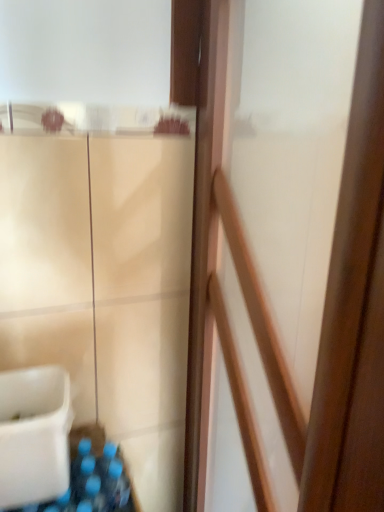
What do you see at coordinates (34, 435) in the screenshot? I see `white plastic sink at lower left` at bounding box center [34, 435].

This screenshot has height=512, width=384. Identify the location of white plastic sink at lower left. (34, 435).

What is the approximate width of wooden screen door at center?

wooden screen door at center is 7.12 inches in width.

In order to face wooden screen door at center, should I rotate leftwards or rightwards?

To face it directly, rotate right by 9.603 degrees.

Describe the element at coordinates (324, 303) in the screenshot. I see `wooden screen door at center` at that location.

This screenshot has height=512, width=384. I want to click on wooden screen door at center, so click(x=324, y=303).

Measure the distance between point (310, 462) and camera.

17.20 inches.

I want to click on white plastic sink at lower left, so click(34, 435).

Can you confirm if wooden screen door at center is positioned to the left of white plastic sink at lower left?

No.

Which object is more forward, wooden screen door at center or white plastic sink at lower left?

wooden screen door at center is more forward.

From the picture: Which is further, (282, 429) or (19, 464)?

The point (19, 464) is farther.

From the image's perspective, is wooden screen door at center located beneath white plastic sink at lower left?

Actually, wooden screen door at center appears above white plastic sink at lower left in the image.

From a real-world perspective, is wooden screen door at center positioned above or below white plastic sink at lower left?

From a real-world perspective, wooden screen door at center is physically above white plastic sink at lower left.

Considering the sizes of objects wooden screen door at center and white plastic sink at lower left in the image provided, who is thinner, wooden screen door at center or white plastic sink at lower left?

wooden screen door at center.

Considering the relative sizes of wooden screen door at center and white plastic sink at lower left in the image provided, is wooden screen door at center shorter than white plastic sink at lower left?

No.

Does wooden screen door at center have a smaller size compared to white plastic sink at lower left?

Incorrect, wooden screen door at center is not smaller in size than white plastic sink at lower left.

Do you think wooden screen door at center is within white plastic sink at lower left, or outside of it?

wooden screen door at center is spatially situated outside white plastic sink at lower left.

Is wooden screen door at center not close to white plastic sink at lower left?

Actually, wooden screen door at center and white plastic sink at lower left are a little close together.

Could you tell me if wooden screen door at center is facing white plastic sink at lower left?

Yes, wooden screen door at center is oriented towards white plastic sink at lower left.

How different are the orientations of wooden screen door at center and white plastic sink at lower left in degrees?

There is a 86.8-degree angle between the facing directions of wooden screen door at center and white plastic sink at lower left.

Find the location of a particular element. Image resolution: width=384 pixels, height=512 pixels. screen door located above the white plastic sink at lower left (from a real-world perspective) is located at coordinates (324, 303).

Is white plastic sink at lower left to the right of wooden screen door at center from the viewer's perspective?

No, white plastic sink at lower left is not to the right of wooden screen door at center.

Relative to wooden screen door at center, is white plastic sink at lower left in front or behind?

Visually, white plastic sink at lower left is located behind wooden screen door at center.

Is point (27, 387) positioned behind point (375, 386)?

Yes, it is behind point (375, 386).

From the image's perspective, which one is positioned higher, white plastic sink at lower left or wooden screen door at center?

wooden screen door at center is shown above in the image.

From a real-world perspective, is white plastic sink at lower left physically located above or below wooden screen door at center?

white plastic sink at lower left is situated lower than wooden screen door at center in the real world.

Which object is thinner, white plastic sink at lower left or wooden screen door at center?

Thinner between the two is wooden screen door at center.

Is white plastic sink at lower left taller than wooden screen door at center?

No, white plastic sink at lower left is not taller than wooden screen door at center.

Can you confirm if white plastic sink at lower left is smaller than wooden screen door at center?

Yes, white plastic sink at lower left is smaller than wooden screen door at center.

Can we say white plastic sink at lower left lies outside wooden screen door at center?

Yes.

Does white plastic sink at lower left touch wooden screen door at center?

No, white plastic sink at lower left is not making contact with wooden screen door at center.

Looking at this image, is white plastic sink at lower left oriented away from wooden screen door at center?

No, white plastic sink at lower left is not facing the opposite direction of wooden screen door at center.

Can you tell me how much white plastic sink at lower left and wooden screen door at center differ in facing direction?

white plastic sink at lower left and wooden screen door at center are facing 86.8 degrees away from each other.

Locate an element on the screen. This screenshot has width=384, height=512. sink that is behind the wooden screen door at center is located at coordinates (34, 435).

You are a GUI agent. You are given a task and a screenshot of the screen. Output one action in this format:
    pyautogui.click(x=<x>, y=<y>)
    Task: Click on the screen door that is above the white plastic sink at lower left (from the image's perspective)
    This screenshot has width=384, height=512.
    Given the screenshot: What is the action you would take?
    pyautogui.click(x=324, y=303)

This screenshot has width=384, height=512. Identify the location of sink lying behind the wooden screen door at center. (34, 435).